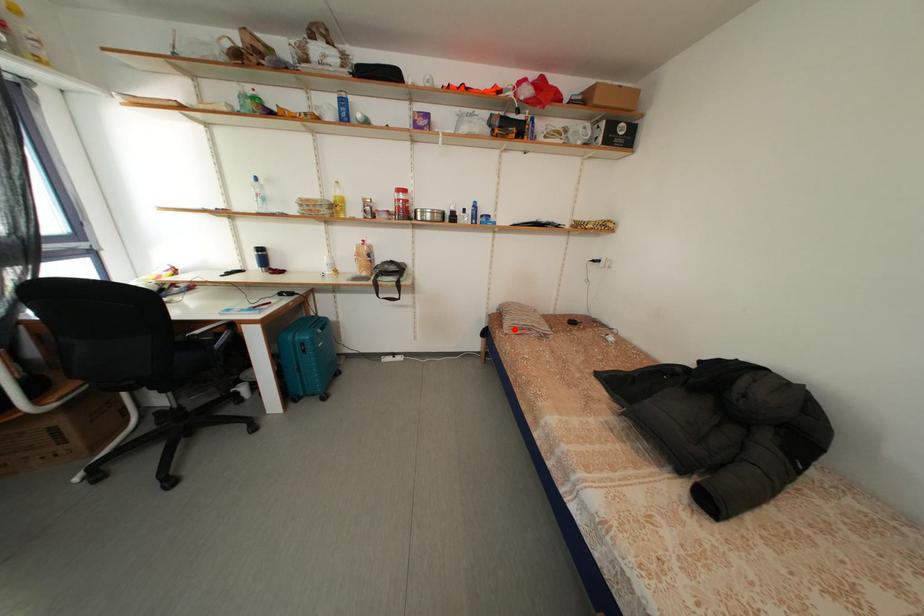
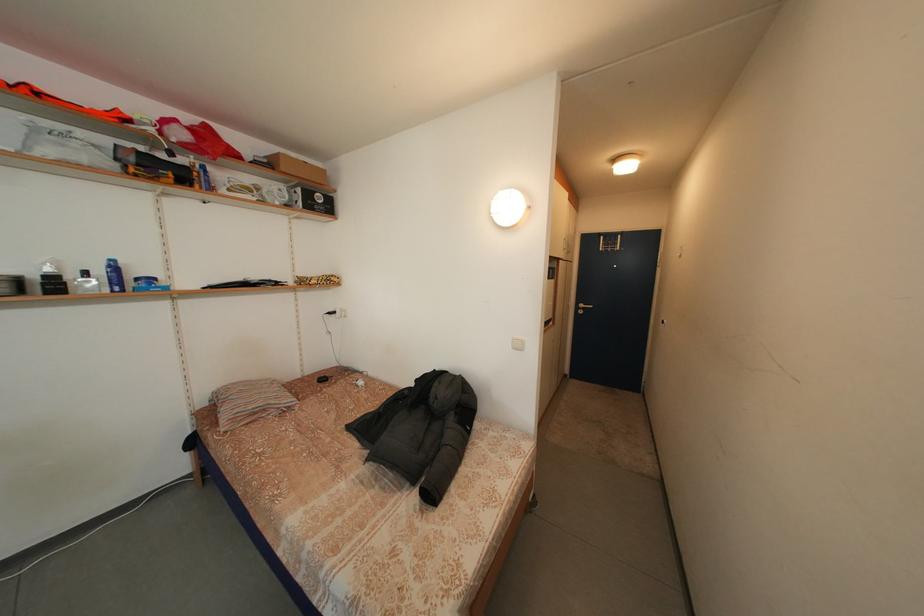
The point at the highlighted location is marked in the first image. Where is the corresponding point in the second image?

(233, 424)